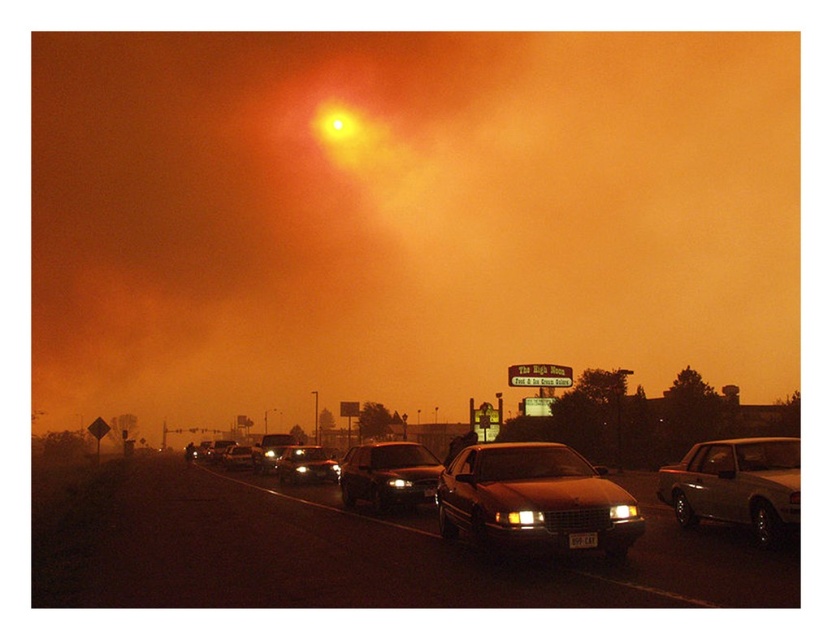
Who is more distant from viewer, (592,502) or (592,536)?

Positioned behind is point (592,502).

Is shiny dark brown sedan at center to the left of black plastic license plate at lower center from the viewer's perspective?

Incorrect, shiny dark brown sedan at center is not on the left side of black plastic license plate at lower center.

Describe the element at coordinates (533, 499) in the screenshot. I see `shiny dark brown sedan at center` at that location.

Locate an element on the screen. This screenshot has width=832, height=640. shiny dark brown sedan at center is located at coordinates (533, 499).

Can you confirm if shiny dark brown sedan at center is thinner than shiny silver sedan at center?

Yes, shiny dark brown sedan at center is thinner than shiny silver sedan at center.

Is point (503, 547) less distant than point (241, 465)?

Yes, point (503, 547) is closer to viewer.

Identify the location of shiny dark brown sedan at center. (533, 499).

Does shiny black sedan at center have a larger size compared to shiny silver sedan at center?

Actually, shiny black sedan at center might be smaller than shiny silver sedan at center.

Which of these two, shiny black sedan at center or shiny silver sedan at center, stands taller?

Standing taller between the two is shiny black sedan at center.

Which is in front, point (399, 465) or point (226, 454)?

Point (399, 465) is more forward.

Where is `shiny black sedan at center`? Image resolution: width=832 pixels, height=640 pixels. shiny black sedan at center is located at coordinates (389, 476).